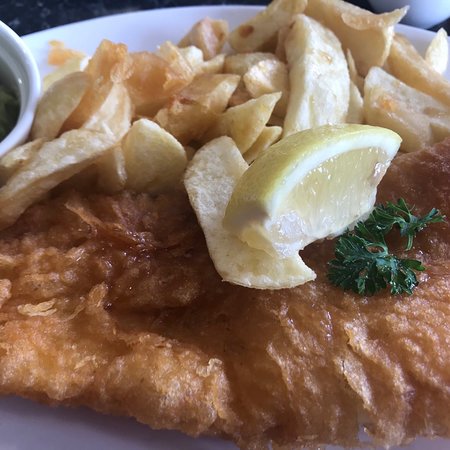
At what (x,y) coordinates should I click in order to perform the action: click on edge of the bowl. Please return your answer as a coordinate pair (x, y). Looking at the image, I should click on (13, 30).